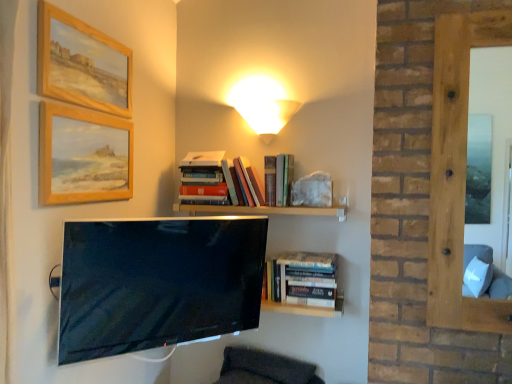
Question: Considering the relative sizes of wooden at upper center and hardcover books at center, positioned as the 3th book in top-to-bottom order, in the image provided, is wooden at upper center smaller than hardcover books at center, positioned as the 3th book in top-to-bottom order,?

Choices:
 (A) no
 (B) yes

Answer: (B)

Question: Does wooden at upper center have a lesser height compared to hardcover books at center, positioned as the 3th book in top-to-bottom order?

Choices:
 (A) no
 (B) yes

Answer: (B)

Question: From a real-world perspective, is wooden at upper center under hardcover books at center, which is counted as the first book, starting from the right?

Choices:
 (A) no
 (B) yes

Answer: (A)

Question: Are wooden at upper center and hardcover books at center, the first book in the bottom-to-top sequence, far apart?

Choices:
 (A) no
 (B) yes

Answer: (A)

Question: Does wooden at upper center appear on the left side of hardcover books at center, the first book in the bottom-to-top sequence?

Choices:
 (A) yes
 (B) no

Answer: (A)

Question: Visually, is smooth wooden frame at right positioned to the left or to the right of matte black tv at center?

Choices:
 (A) left
 (B) right

Answer: (B)

Question: Based on their sizes in the image, would you say smooth wooden frame at right is bigger or smaller than matte black tv at center?

Choices:
 (A) small
 (B) big

Answer: (A)

Question: In terms of height, does smooth wooden frame at right look taller or shorter compared to matte black tv at center?

Choices:
 (A) tall
 (B) short

Answer: (A)

Question: From the image's perspective, is smooth wooden frame at right above or below matte black tv at center?

Choices:
 (A) below
 (B) above

Answer: (B)

Question: Based on their sizes in the image, would you say matte black tv at center is bigger or smaller than wooden framed painting at upper left, the first picture frame in the top-to-bottom sequence?

Choices:
 (A) small
 (B) big

Answer: (B)

Question: From a real-world perspective, is matte black tv at center above or below wooden framed painting at upper left, the first picture frame in the top-to-bottom sequence?

Choices:
 (A) below
 (B) above

Answer: (A)

Question: Visually, is matte black tv at center positioned to the left or to the right of wooden framed painting at upper left, which is the second picture frame from bottom to top?

Choices:
 (A) left
 (B) right

Answer: (B)

Question: Does point (62, 349) appear closer or farther from the camera than point (39, 92)?

Choices:
 (A) farther
 (B) closer

Answer: (A)

Question: Considering their positions, is hardcover books at upper center, which is the 2th book from bottom to top, located in front of or behind wooden painted picture frame at upper left, arranged as the 1th picture frame when ordered from the bottom?

Choices:
 (A) front
 (B) behind

Answer: (B)

Question: Is hardcover books at upper center, acting as the 2th book starting from the top, taller or shorter than wooden painted picture frame at upper left, arranged as the 1th picture frame when ordered from the bottom?

Choices:
 (A) short
 (B) tall

Answer: (A)